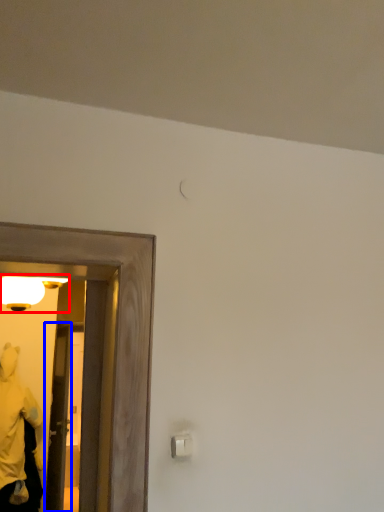
Question: Which of the following is the closest to the observer, light fixture (highlighted by a red box) or door (highlighted by a blue box)?

Choices:
 (A) light fixture
 (B) door

Answer: (A)